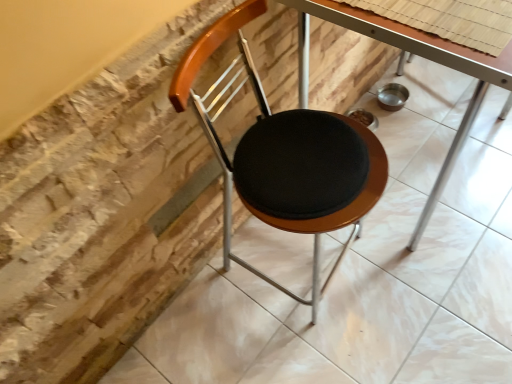
Question: Looking at the image, does metallic silver table at center seem bigger or smaller compared to matte black seat at center?

Choices:
 (A) small
 (B) big

Answer: (B)

Question: Is metallic silver table at center wider or thinner than matte black seat at center?

Choices:
 (A) thin
 (B) wide

Answer: (B)

Question: Choose the correct answer: Is metallic silver table at center inside matte black seat at center or outside it?

Choices:
 (A) inside
 (B) outside

Answer: (B)

Question: In terms of size, does matte black seat at center appear bigger or smaller than metallic silver table at center?

Choices:
 (A) small
 (B) big

Answer: (A)

Question: From the image's perspective, is matte black seat at center above or below metallic silver table at center?

Choices:
 (A) above
 (B) below

Answer: (B)

Question: Is matte black seat at center taller or shorter than metallic silver table at center?

Choices:
 (A) short
 (B) tall

Answer: (B)

Question: Considering their positions, is matte black seat at center located in front of or behind metallic silver table at center?

Choices:
 (A) front
 (B) behind

Answer: (A)